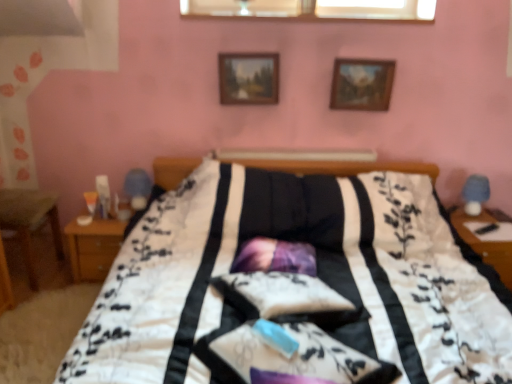
Describe the element at coordinates (475, 193) in the screenshot. The height and width of the screenshot is (384, 512). I see `blue fabric table lamp at right` at that location.

Measure the distance between blue fabric table lamp at right and camera.

They are 8.44 feet apart.

The image size is (512, 384). I want to click on purple satin pillow at center, so (x=275, y=257).

Where is `transparent glass window at upper center`? The height and width of the screenshot is (384, 512). transparent glass window at upper center is located at coordinates (313, 9).

The image size is (512, 384). Identify the location of wooden picture frame at upper center, arranged as the 2th picture frame when viewed from the left. (362, 84).

From the image's perspective, which object appears higher, blue fabric table lamp at right or wooden nightstand at left?

blue fabric table lamp at right is shown above in the image.

From the picture: Which of these two, blue fabric table lamp at right or wooden nightstand at left, stands taller?

wooden nightstand at left.

From a real-world perspective, which object rests below the other?

wooden nightstand at left is physically lower.

Is point (473, 177) more distant than point (80, 267)?

Yes.

Is wooden nightstand at right located outside transparent glass window at upper center?

Indeed, wooden nightstand at right is completely outside transparent glass window at upper center.

Would you say wooden nightstand at right is to the left or to the right of transparent glass window at upper center in the picture?

Clearly, wooden nightstand at right is on the right of transparent glass window at upper center in the image.

From the image's perspective, is wooden nightstand at right above transparent glass window at upper center?

No.

Considering the relative sizes of wooden nightstand at right and transparent glass window at upper center in the image provided, is wooden nightstand at right wider than transparent glass window at upper center?

Indeed, wooden nightstand at right has a greater width compared to transparent glass window at upper center.

Choose the correct answer: Is purple satin pillow at center inside transparent glass window at upper center or outside it?

purple satin pillow at center is not inside transparent glass window at upper center, it's outside.

Is purple satin pillow at center facing away from transparent glass window at upper center?

No.

Between purple satin pillow at center and transparent glass window at upper center, which one is positioned in front?

Positioned in front is purple satin pillow at center.

Starting from the wooden nightstand at right, which picture frame is the 2nd one behind? Please provide its 2D coordinates.

[(362, 84)]

From the image's perspective, is wooden nightstand at right on top of wooden picture frame at upper center, arranged as the 2th picture frame when viewed from the left?

Incorrect, from the image's perspective, wooden nightstand at right is lower than wooden picture frame at upper center, arranged as the 2th picture frame when viewed from the left.

Between wooden nightstand at right and wooden picture frame at upper center, arranged as the 2th picture frame when viewed from the left, which one has less height?

With less height is wooden picture frame at upper center, arranged as the 2th picture frame when viewed from the left.

Choose the correct answer: Is wooden nightstand at right inside wooden picture frame at upper center, arranged as the 1th picture frame when viewed from the right, or outside it?

wooden nightstand at right is outside wooden picture frame at upper center, arranged as the 1th picture frame when viewed from the right.

Is point (277, 264) in front of point (489, 185)?

Yes.

How many degrees apart are the facing directions of purple satin pillow at center and blue fabric table lamp at right?

The angle between the facing direction of purple satin pillow at center and the facing direction of blue fabric table lamp at right is 11 degrees.

Find the location of a particular element. The width and height of the screenshot is (512, 384). table lamp above the purple satin pillow at center (from a real-world perspective) is located at coordinates (475, 193).

Is purple satin pillow at center facing away from blue fabric table lamp at right?

That's not correct — purple satin pillow at center is not looking away from blue fabric table lamp at right.

Is wooden nightstand at left oriented towards purple satin pillow at center?

No, wooden nightstand at left does not turn towards purple satin pillow at center.

Is wooden nightstand at left not inside purple satin pillow at center?

wooden nightstand at left lies outside purple satin pillow at center's area.

Consider the image. Which object is further away from the camera taking this photo, wooden nightstand at left or purple satin pillow at center?

wooden nightstand at left is more distant.

From the picture: Considering the sizes of transparent glass window at upper center and purple satin pillow at center in the image, is transparent glass window at upper center bigger or smaller than purple satin pillow at center?

In the image, transparent glass window at upper center appears to be smaller than purple satin pillow at center.

From the image's perspective, does transparent glass window at upper center appear lower than purple satin pillow at center?

No, from the image's perspective, transparent glass window at upper center is not beneath purple satin pillow at center.

Is transparent glass window at upper center in contact with purple satin pillow at center?

transparent glass window at upper center and purple satin pillow at center are not in contact.

Between point (216, 12) and point (305, 243), which one is positioned behind?

The point (216, 12) is farther.

In order to click on nightstand lying on the left of blue fabric table lamp at right in this screenshot , I will do `click(93, 247)`.

What are the coordinates of `table in front of the transparent glass window at upper center` in the screenshot? It's located at (485, 243).

From the image, which object appears to be farther from wooden picture frame at upper center, the second picture frame when ordered from right to left, wooden nightstand at left or transparent glass window at upper center?

wooden nightstand at left is positioned further to the anchor wooden picture frame at upper center, the second picture frame when ordered from right to left.

Looking at the image, which one is located further to wooden picture frame at upper center, arranged as the 2th picture frame when viewed from the left, wooden nightstand at right or wooden picture frame at upper center, the second picture frame when ordered from right to left?

wooden nightstand at right is positioned further to the anchor wooden picture frame at upper center, arranged as the 2th picture frame when viewed from the left.

From the image, which object appears to be nearer to transparent glass window at upper center, wooden nightstand at right or blue fabric table lamp at right?

Among the two, blue fabric table lamp at right is located nearer to transparent glass window at upper center.

Estimate the real-world distances between objects in this image. Which object is further from transparent glass window at upper center, wooden picture frame at upper center, arranged as the 2th picture frame when viewed from the left, or wooden nightstand at right?

Among the two, wooden nightstand at right is located further to transparent glass window at upper center.

When comparing their distances from blue fabric table lamp at right, does wooden picture frame at upper center, arranged as the 2th picture frame when viewed from the left, or transparent glass window at upper center seem closer?

wooden picture frame at upper center, arranged as the 2th picture frame when viewed from the left.

Considering their positions, is purple satin pillow at center positioned further to blue fabric table lamp at right than wooden picture frame at upper center, arranged as the 1th picture frame when viewed from the right?

purple satin pillow at center is positioned further to the anchor blue fabric table lamp at right.

Estimate the real-world distances between objects in this image. Which object is closer to purple satin pillow at center, transparent glass window at upper center or blue fabric table lamp at right?

blue fabric table lamp at right is closer to purple satin pillow at center.

Looking at the image, which one is located further to wooden picture frame at upper center, arranged as the 1th picture frame when viewed from the right, purple satin pillow at center or blue fabric table lamp at right?

purple satin pillow at center is further to wooden picture frame at upper center, arranged as the 1th picture frame when viewed from the right.

Image resolution: width=512 pixels, height=384 pixels. Find the location of `pillow situated between wooden picture frame at upper center, which is counted as the 1th picture frame, starting from the left, and wooden nightstand at right from left to right`. pillow situated between wooden picture frame at upper center, which is counted as the 1th picture frame, starting from the left, and wooden nightstand at right from left to right is located at coordinates (275, 257).

Locate an element on the screen. table between wooden picture frame at upper center, which is counted as the 1th picture frame, starting from the left, and blue fabric table lamp at right from left to right is located at coordinates (485, 243).

Image resolution: width=512 pixels, height=384 pixels. I want to click on pillow between wooden nightstand at left and wooden picture frame at upper center, arranged as the 1th picture frame when viewed from the right, so click(x=275, y=257).

Where is `picture frame between wooden picture frame at upper center, the second picture frame when ordered from right to left, and purple satin pillow at center, in the vertical direction`? This screenshot has height=384, width=512. picture frame between wooden picture frame at upper center, the second picture frame when ordered from right to left, and purple satin pillow at center, in the vertical direction is located at coordinates coord(362,84).